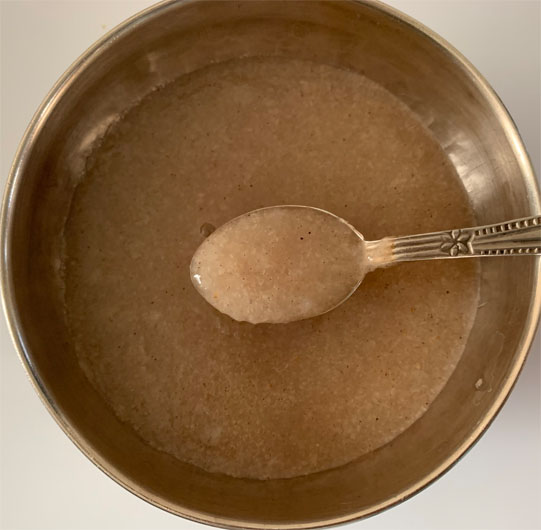
The height and width of the screenshot is (530, 541). Find the location of `white tabletop`. white tabletop is located at coordinates (496, 441).